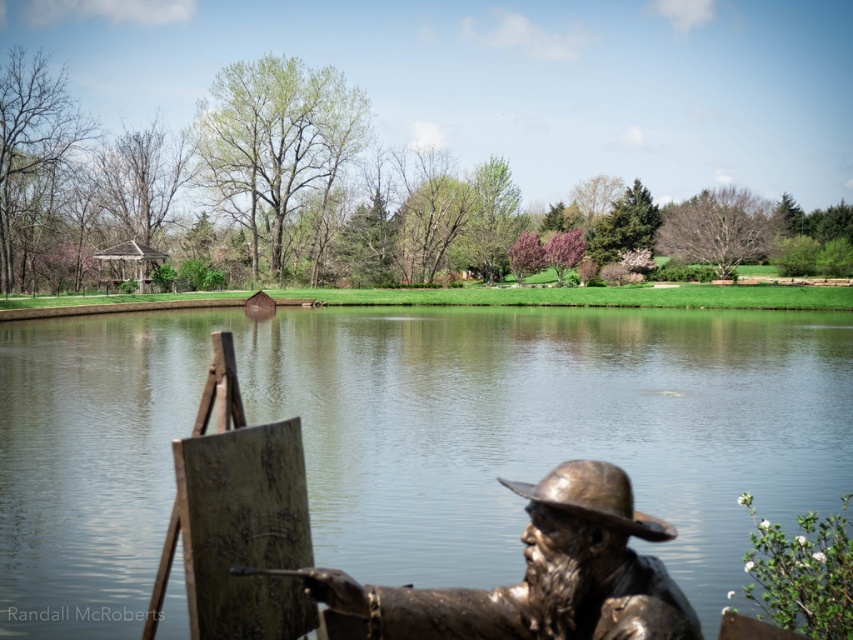
You are standing at the bronze statue of a painter in the foreground. You want to walk to the point marked at coordinates [413,438]. Which direction should you head towards?

The point marked at coordinates [413,438] is located on clear water at center, so you should head towards the center of the calm body of water in the midground to reach it.

You are a tourist visiting the park and want to take a photo of the bronze statue at lower right without the clear water at center appearing in the background. Is this possible based on their positions?

The bronze statue at lower right is behind the clear water at center, so you cannot take a photo of the bronze statue at lower right without the clear water at center appearing in the background.